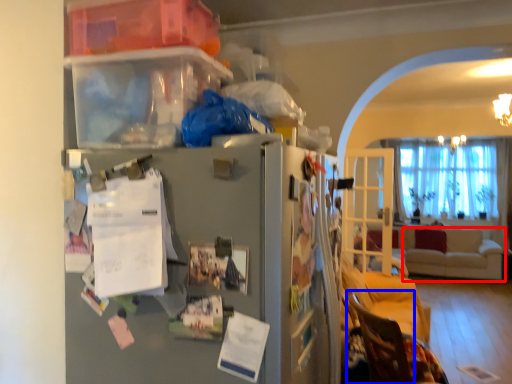
Question: Which object is further to the camera taking this photo, studio couch (highlighted by a red box) or armchair (highlighted by a blue box)?

Choices:
 (A) studio couch
 (B) armchair

Answer: (A)